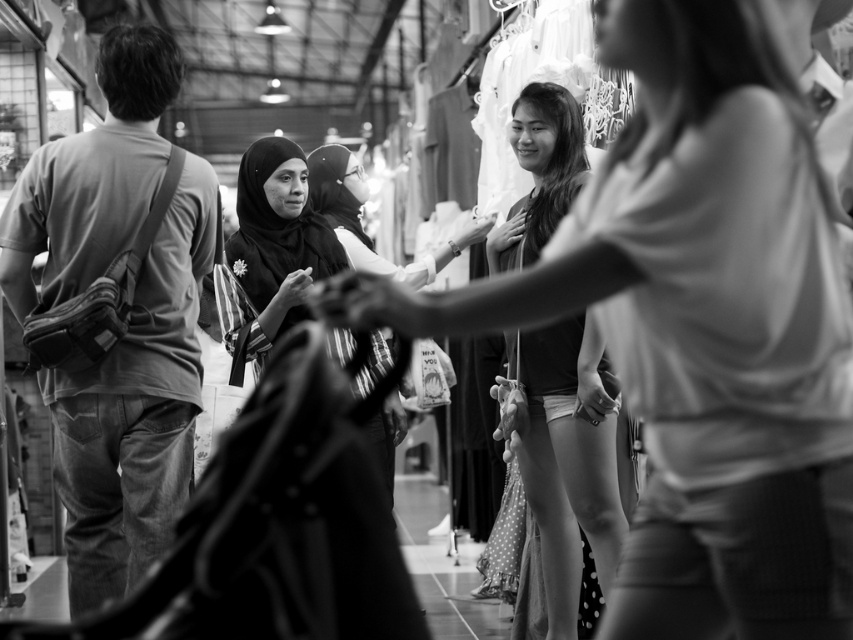
Question: Which object is farther from the camera taking this photo?

Choices:
 (A) smooth fabric blouse at center
 (B) matte black hijab at center
 (C) denim jeans at left

Answer: (B)

Question: Which of the following is the closest to the observer?

Choices:
 (A) smooth fabric blouse at center
 (B) matte black hijab at center
 (C) denim jeans at left

Answer: (C)

Question: Among these objects, which one is nearest to the camera?

Choices:
 (A) denim jeans at left
 (B) smooth fabric blouse at center

Answer: (A)

Question: Is denim jeans at left positioned in front of matte black hijab at center?

Choices:
 (A) no
 (B) yes

Answer: (B)

Question: Can you confirm if denim jeans at left is bigger than matte black hijab at center?

Choices:
 (A) no
 (B) yes

Answer: (B)

Question: Can you confirm if denim jeans at left is positioned above smooth fabric blouse at center?

Choices:
 (A) yes
 (B) no

Answer: (A)